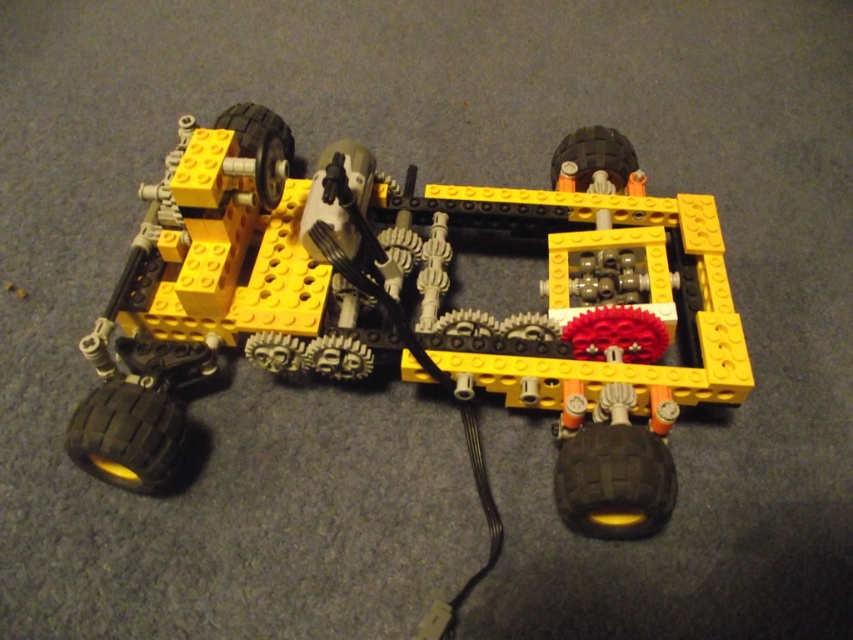
Question: Based on their relative distances, which object is nearer to the black rubber tire at upper center?

Choices:
 (A) black rubber tire at upper right
 (B) yellow plastic car at center
 (C) black rubber tire at lower right

Answer: (B)

Question: Based on their relative distances, which object is farther from the black rubber tire at lower right?

Choices:
 (A) yellow plastic car at center
 (B) black rubber tire at lower left

Answer: (B)

Question: Can you confirm if black rubber tire at lower left is thinner than black rubber tire at upper center?

Choices:
 (A) yes
 (B) no

Answer: (B)

Question: Is yellow plastic car at center bigger than black rubber tire at lower left?

Choices:
 (A) yes
 (B) no

Answer: (A)

Question: Is yellow plastic car at center positioned before black rubber tire at lower right?

Choices:
 (A) yes
 (B) no

Answer: (B)

Question: Considering the real-world distances, which object is farthest from the black rubber tire at upper right?

Choices:
 (A) yellow plastic car at center
 (B) black rubber tire at lower right
 (C) black rubber tire at lower left
 (D) black rubber tire at upper center

Answer: (C)